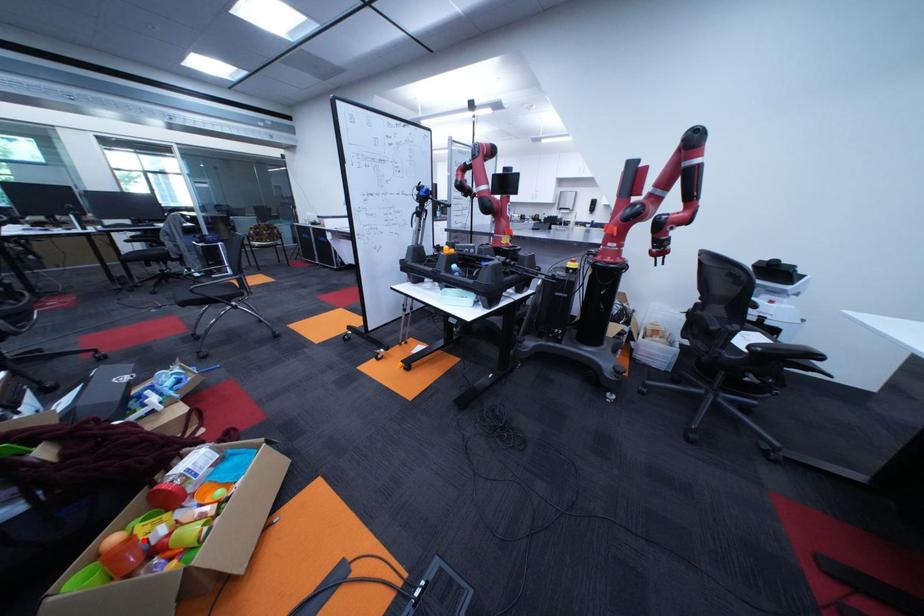
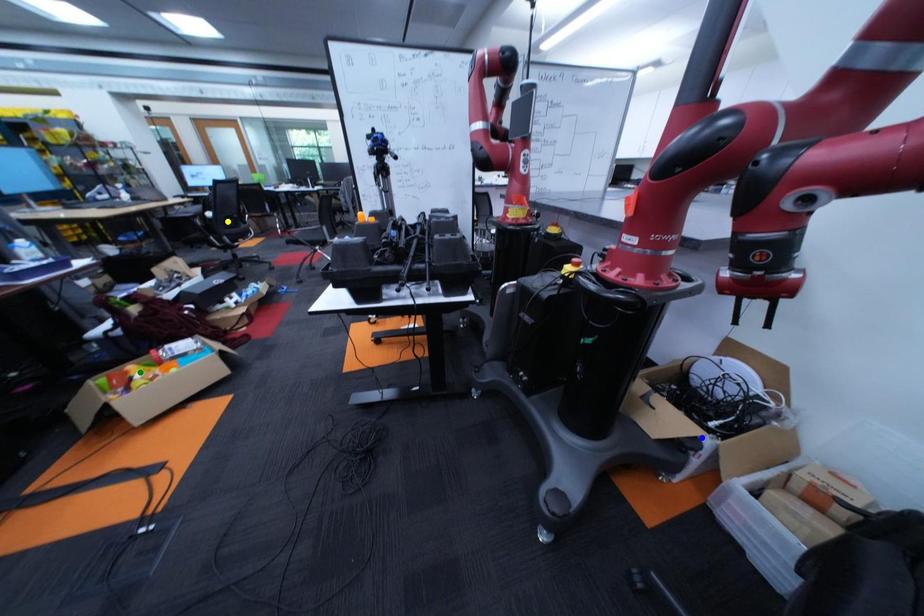
Question: I am providing you with two images of the same scene from different viewpoints. A red point is marked on the first image. You are given multiple points on the second image. In image 2, which mark is for the same physical point as the one in image 1?

Choices:
 (A) yellow point
 (B) blue point
 (C) green point

Answer: (C)